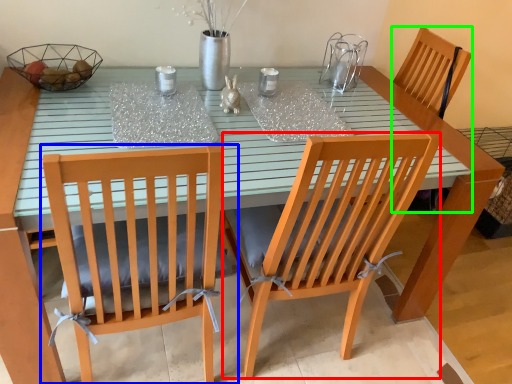
Question: Based on their relative distances, which object is nearer to chair (highlighted by a red box)? Choose from chair (highlighted by a blue box) and armchair (highlighted by a green box).

Choices:
 (A) chair
 (B) armchair

Answer: (A)